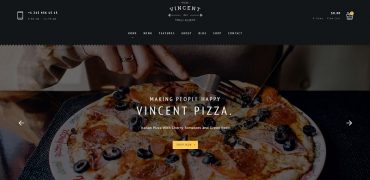
You are a GUI agent. You are given a task and a screenshot of the screen. Output one action in this format:
    pyautogui.click(x=<x>, y=<y>)
    Task: Click on the place mat
    
    Given the screenshot: What is the action you would take?
    pyautogui.click(x=35, y=171)